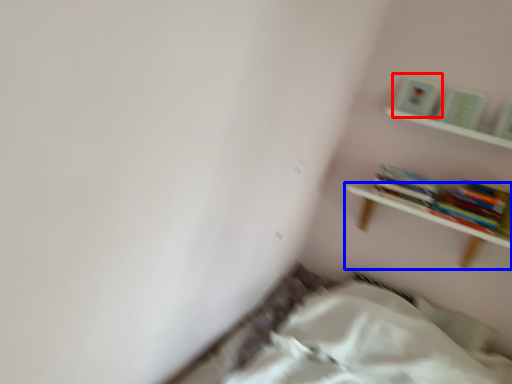
Question: Which point is closer to the camera, paperback book (highlighted by a red box) or shelf (highlighted by a blue box)?

Choices:
 (A) paperback book
 (B) shelf

Answer: (B)